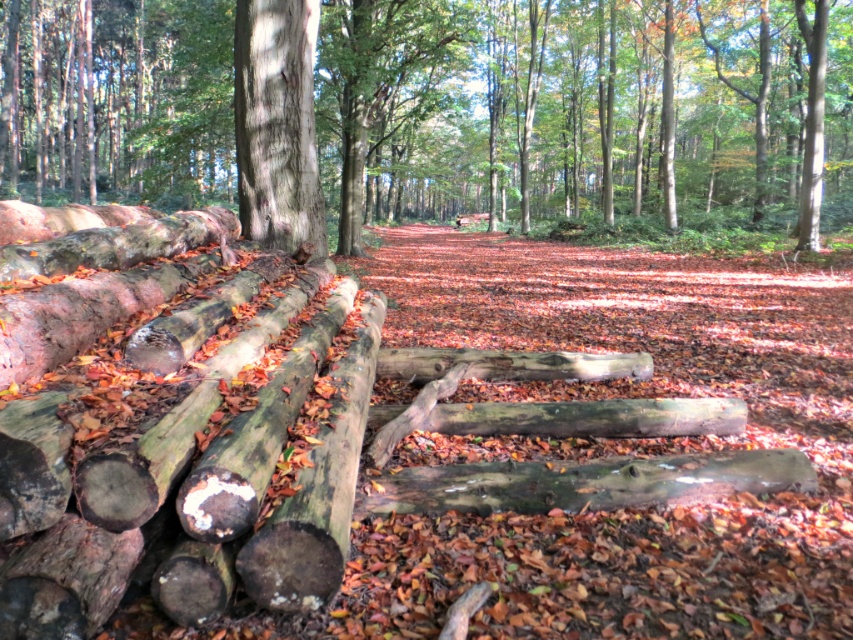
Question: Is smooth bark tree at center closer to camera compared to smooth gray bark at center?

Choices:
 (A) no
 (B) yes

Answer: (A)

Question: Can you confirm if smooth bark tree at center is positioned to the left of smooth gray bark at center?

Choices:
 (A) yes
 (B) no

Answer: (A)

Question: Does smooth bark tree at center have a smaller size compared to smooth gray bark at center?

Choices:
 (A) no
 (B) yes

Answer: (A)

Question: Which point is closer to the camera taking this photo?

Choices:
 (A) (312, 154)
 (B) (105, 32)

Answer: (A)